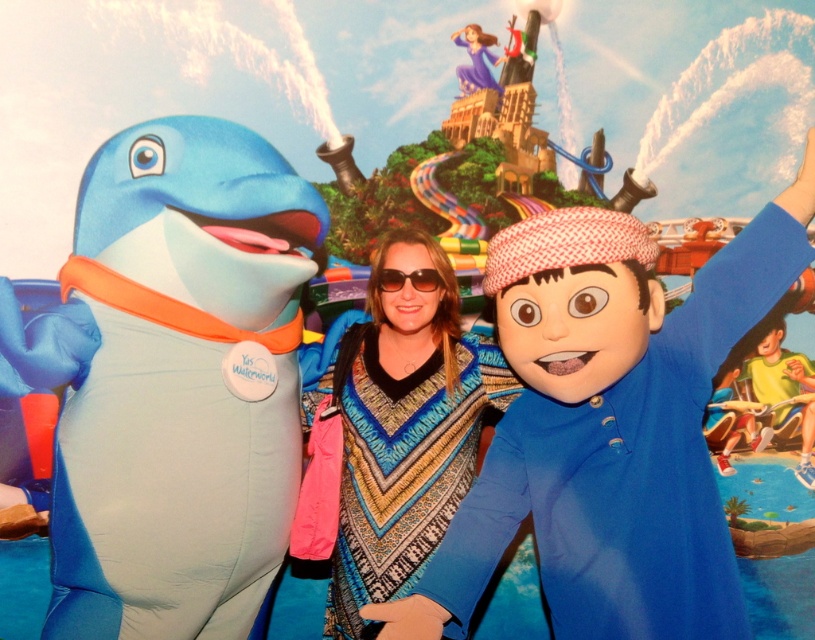
Which is more to the left, purple satin dress at upper center or sunglasses at center?

Positioned to the left is sunglasses at center.

Which of these two, purple satin dress at upper center or sunglasses at center, stands taller?

Standing taller between the two is purple satin dress at upper center.

Is point (476, 81) in front of point (379, 269)?

No, it is behind (379, 269).

The height and width of the screenshot is (640, 815). I want to click on purple satin dress at upper center, so click(476, 60).

Measure the distance between blue fabric character at right and camera.

blue fabric character at right and camera are 1.75 meters apart.

Can you confirm if blue fabric character at right is thinner than sunglasses at center?

→ In fact, blue fabric character at right might be wider than sunglasses at center.

At what (x,y) coordinates should I click in order to perform the action: click on blue fabric character at right. Please return your answer as a coordinate pair (x, y). Looking at the image, I should click on (610, 436).

Between point (311, 452) and point (494, 61), which one is positioned behind?

Point (494, 61)

Does patterned poncho at center have a lesser width compared to purple satin dress at upper center?

No.

Is point (369, 524) in front of point (461, 29)?

Yes, point (369, 524) is in front of point (461, 29).

The height and width of the screenshot is (640, 815). I want to click on patterned poncho at center, so click(395, 435).